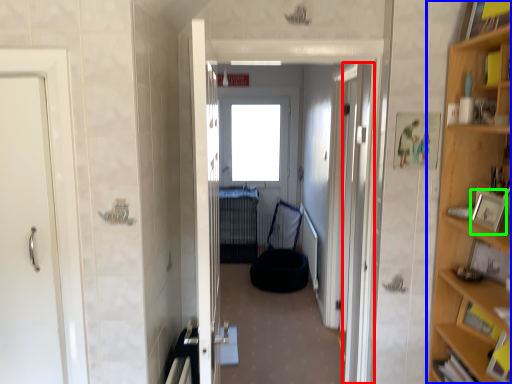
Question: Considering the real-world distances, which object is farthest from door (highlighted by a red box)? cabinetry (highlighted by a blue box) or picture frame (highlighted by a green box)?

Choices:
 (A) cabinetry
 (B) picture frame

Answer: (B)